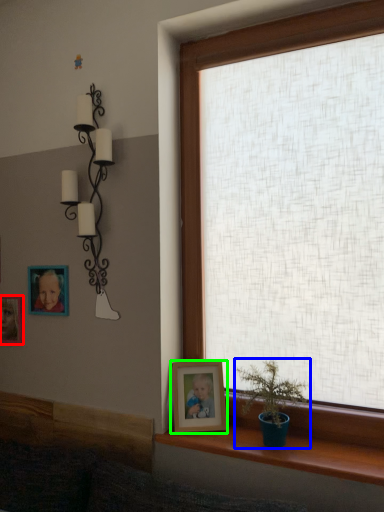
Question: Which object is the closest to the picture frame (highlighted by a red box)? Choose among these: houseplant (highlighted by a blue box) or picture frame (highlighted by a green box).

Choices:
 (A) houseplant
 (B) picture frame

Answer: (B)